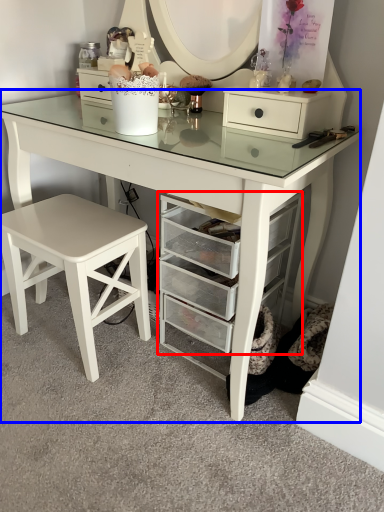
Question: Which point is closer to the camera, shelf (highlighted by a red box) or table (highlighted by a blue box)?

Choices:
 (A) shelf
 (B) table

Answer: (B)